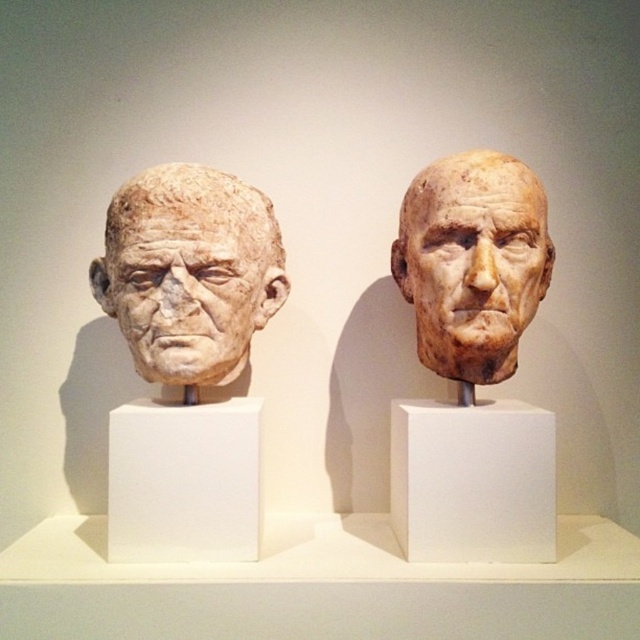
You are an art student who needs to decide which head to sketch first. The matte clay head at center and the matte stone head at left are both in front of you. Which one is larger in size?

The matte clay head at center is bigger than the matte stone head at left, so you should sketch the matte clay head at center first if you want to start with the larger one.

You are an art conservator examining the two busts in the museum exhibit. You need to place a protective cloth over both the matte clay head at center and the matte stone head at left. Based on their positions, which bust should you cover first to avoid blocking the other?

The matte clay head at center is positioned over the matte stone head at left, so you should cover the matte stone head at left first to avoid blocking the matte clay head at center.